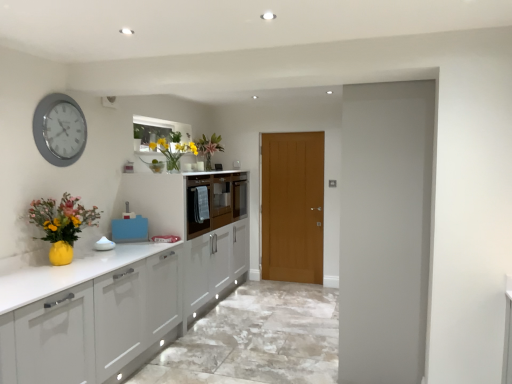
Question: Is matte white cabinetry at center thinner than matte wood door at center?

Choices:
 (A) no
 (B) yes

Answer: (A)

Question: Is matte wood door at center inside matte white cabinetry at center?

Choices:
 (A) yes
 (B) no

Answer: (B)

Question: Is matte white cabinetry at center shorter than matte wood door at center?

Choices:
 (A) no
 (B) yes

Answer: (B)

Question: Is matte white cabinetry at center positioned in front of matte wood door at center?

Choices:
 (A) no
 (B) yes

Answer: (B)

Question: Is matte white cabinetry at center not near matte wood door at center?

Choices:
 (A) no
 (B) yes

Answer: (B)

Question: From a real-world perspective, is matte yellow vase at lower left, the 3th floral arrangement in the right-to-left sequence, positioned above or below matte white cabinetry at center?

Choices:
 (A) above
 (B) below

Answer: (B)

Question: Is matte yellow vase at lower left, the third floral arrangement when ordered from back to front, in front of or behind matte white cabinetry at center in the image?

Choices:
 (A) front
 (B) behind

Answer: (A)

Question: Considering the positions of point (70, 201) and point (245, 190), is point (70, 201) closer or farther from the camera than point (245, 190)?

Choices:
 (A) closer
 (B) farther

Answer: (A)

Question: Do you think matte yellow vase at lower left, placed as the first floral arrangement when sorted from bottom to top, is within matte white cabinetry at center, or outside of it?

Choices:
 (A) outside
 (B) inside

Answer: (A)

Question: In the image, is translucent glass vase at upper center, positioned as the second floral arrangement in top-to-bottom order, on the left side or the right side of matte yellow vase at lower left, which is counted as the first floral arrangement, starting from the left?

Choices:
 (A) left
 (B) right

Answer: (B)

Question: Considering the positions of translucent glass vase at upper center, positioned as the second floral arrangement in top-to-bottom order, and matte yellow vase at lower left, the first floral arrangement in the front-to-back sequence, in the image, is translucent glass vase at upper center, positioned as the second floral arrangement in top-to-bottom order, wider or thinner than matte yellow vase at lower left, the first floral arrangement in the front-to-back sequence,?

Choices:
 (A) thin
 (B) wide

Answer: (B)

Question: Does point (175, 157) appear closer or farther from the camera than point (74, 230)?

Choices:
 (A) closer
 (B) farther

Answer: (B)

Question: From a real-world perspective, is translucent glass vase at upper center, the second floral arrangement from the bottom, above or below matte yellow vase at lower left, placed as the first floral arrangement when sorted from bottom to top?

Choices:
 (A) above
 (B) below

Answer: (A)

Question: From the image's perspective, is silver metallic clock at upper left positioned above or below matte yellow vase at lower left, the first floral arrangement in the front-to-back sequence?

Choices:
 (A) below
 (B) above

Answer: (B)

Question: Choose the correct answer: Is silver metallic clock at upper left inside matte yellow vase at lower left, the 3th floral arrangement in the right-to-left sequence, or outside it?

Choices:
 (A) inside
 (B) outside

Answer: (B)